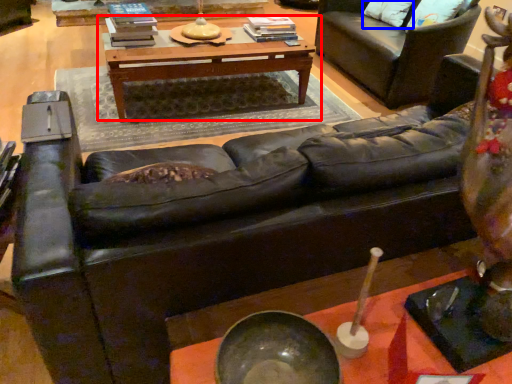
Question: Which object is further to the camera taking this photo, table (highlighted by a red box) or pillow (highlighted by a blue box)?

Choices:
 (A) table
 (B) pillow

Answer: (B)